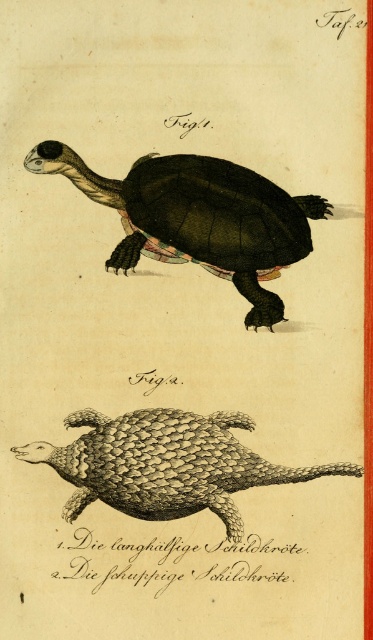
Does matte black turtle at center have a larger size compared to shiny scaly pangolin at bottom center?

Indeed, matte black turtle at center has a larger size compared to shiny scaly pangolin at bottom center.

Is point (255, 216) positioned before point (133, 472)?

No, it is behind (133, 472).

Between point (132, 186) and point (259, 481), which one is positioned behind?

The point (132, 186) is more distant.

What are the coordinates of `matte black turtle at center` in the screenshot? It's located at (199, 218).